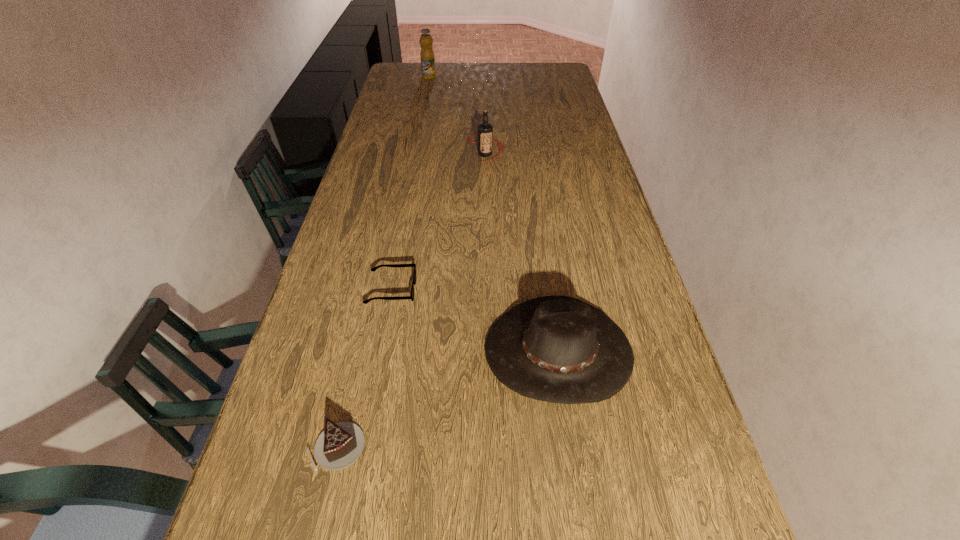
Where is `the tallest object`? Image resolution: width=960 pixels, height=540 pixels. the tallest object is located at coordinates (427, 57).

Locate an element on the screen. Image resolution: width=960 pixels, height=540 pixels. the farthest object is located at coordinates (427, 57).

This screenshot has width=960, height=540. I want to click on the second farthest object, so click(485, 130).

Locate an element on the screen. Image resolution: width=960 pixels, height=540 pixels. root beer is located at coordinates (485, 130).

This screenshot has width=960, height=540. What are the coordinates of `hat` in the screenshot? It's located at (558, 349).

Locate an element on the screen. the nearest object is located at coordinates (340, 444).

In order to click on the second shortest object in this screenshot , I will do `click(340, 444)`.

The height and width of the screenshot is (540, 960). I want to click on spectacles, so click(411, 296).

I want to click on free space located 0.300m on the front label of the fruit juice, so click(500, 77).

What are the coordinates of `free space located on the label of the root beer` in the screenshot? It's located at (487, 232).